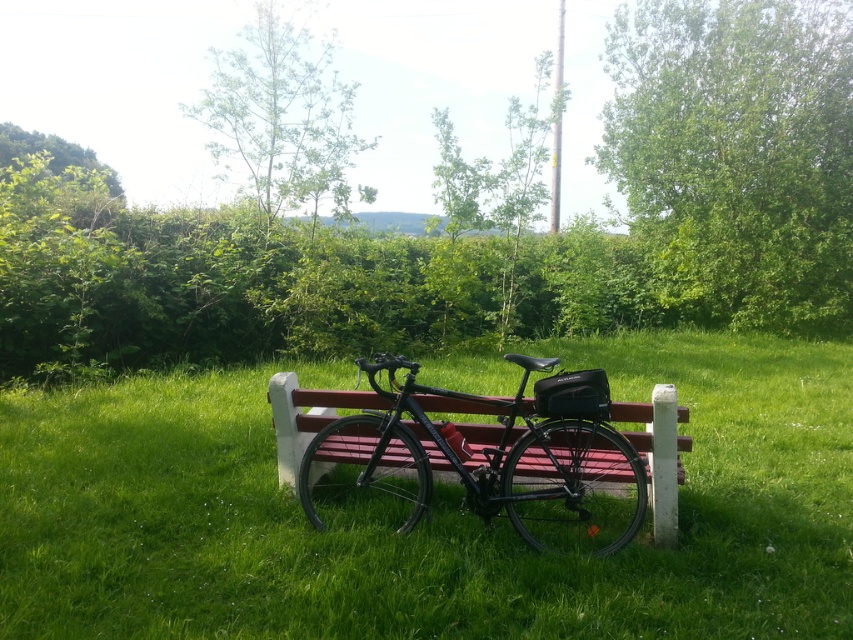
Can you confirm if green grass at center is positioned above green leafy tree at upper center?

No.

Based on the photo, does green grass at center come in front of green leafy tree at upper center?

Yes, it is.

Does point (161, 609) lie behind point (334, 180)?

No, (161, 609) is in front of (334, 180).

The height and width of the screenshot is (640, 853). What are the coordinates of `green grass at center` in the screenshot? It's located at (432, 515).

Is green leafy tree at upper center taller than green leafy tree at upper left?

Indeed, green leafy tree at upper center has a greater height compared to green leafy tree at upper left.

Who is more forward, (x=244, y=109) or (x=57, y=163)?

Point (x=244, y=109) is more forward.

Describe the element at coordinates (282, 115) in the screenshot. I see `green leafy tree at upper center` at that location.

The width and height of the screenshot is (853, 640). I want to click on green leafy tree at upper center, so click(x=282, y=115).

Can you confirm if green leafy tree at upper right is positioned to the left of shiny black bicycle at center?

Incorrect, green leafy tree at upper right is not on the left side of shiny black bicycle at center.

Does green leafy tree at upper right have a greater height compared to shiny black bicycle at center?

Yes.

Describe the element at coordinates (737, 154) in the screenshot. The image size is (853, 640). I see `green leafy tree at upper right` at that location.

Where is `green leafy tree at upper right`? green leafy tree at upper right is located at coordinates (737, 154).